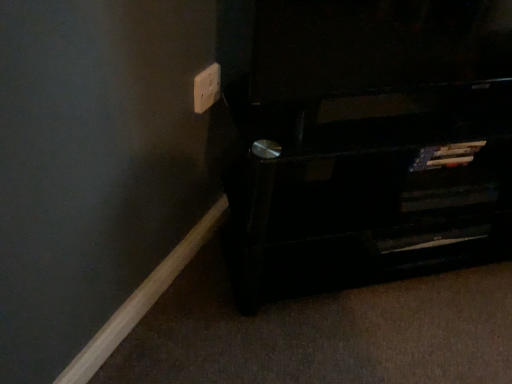
You are a GUI agent. You are given a task and a screenshot of the screen. Output one action in this format:
    pyautogui.click(x=<x>, y=<y>)
    Task: Click on the free space in front of black wood shelf at lower right
    This screenshot has width=512, height=384.
    Given the screenshot: What is the action you would take?
    pyautogui.click(x=399, y=329)